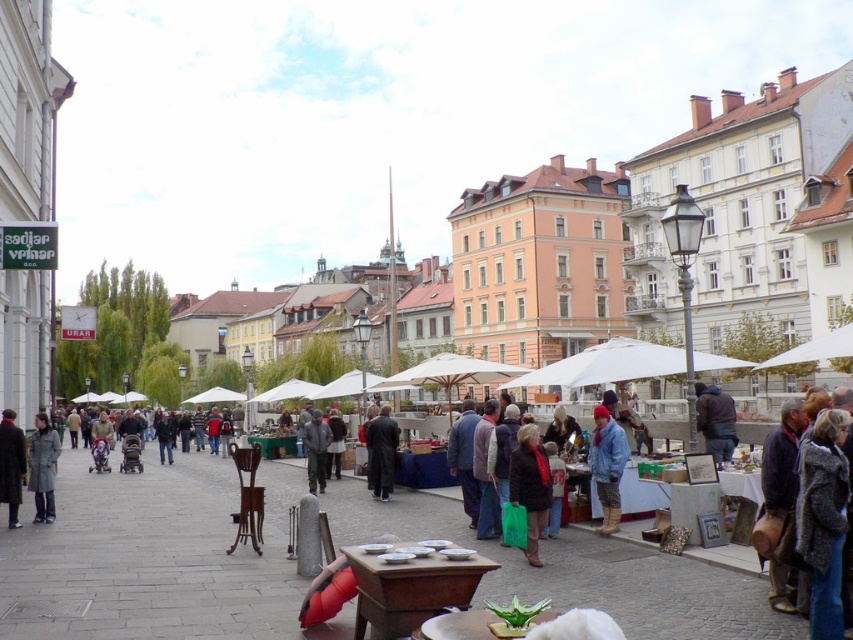
Who is positioned more to the right, gray wool coat at center or dark gray coat at lower left?

Positioned to the right is dark gray coat at lower left.

Can you confirm if gray wool coat at center is shorter than dark gray coat at lower left?

No, gray wool coat at center is not shorter than dark gray coat at lower left.

Describe the element at coordinates (42, 467) in the screenshot. I see `gray wool coat at center` at that location.

I want to click on gray wool coat at center, so click(x=42, y=467).

Is point (4, 444) positioned in front of point (323, 467)?

That is True.

Find the location of a particular element. This screenshot has width=853, height=640. dark gray coat at lower left is located at coordinates (10, 465).

Locate an element on the screen. dark gray coat at lower left is located at coordinates (10, 465).

Does gray wool coat at center appear over dark gray jacket at center?

Yes.

Does gray wool coat at center have a greater height compared to dark gray jacket at center?

Yes, gray wool coat at center is taller than dark gray jacket at center.

Which is behind, point (48, 470) or point (306, 444)?

Positioned behind is point (306, 444).

What are the coordinates of `gray wool coat at center` in the screenshot? It's located at (42, 467).